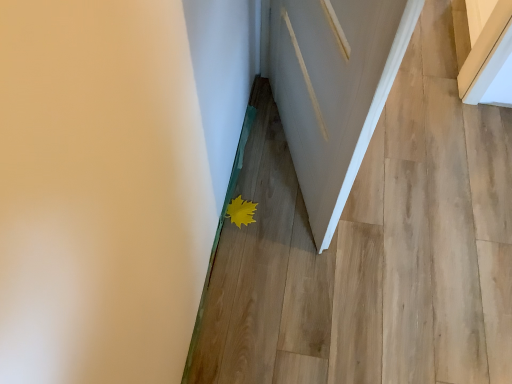
Locate an element on the screen. vacant point to the right of white wood door at center is located at coordinates (428, 195).